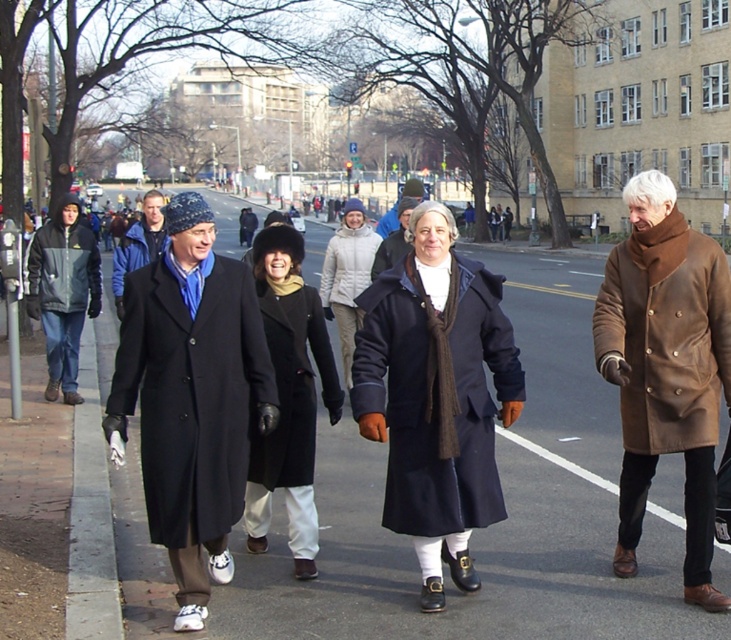
Is brown leather coat at right below white puffy coat at center?

Correct, brown leather coat at right is located below white puffy coat at center.

Does brown leather coat at right have a lesser height compared to white puffy coat at center?

No.

This screenshot has height=640, width=731. I want to click on brown leather coat at right, so click(x=666, y=336).

Find the location of `brown leather coat at right`. brown leather coat at right is located at coordinates (666, 336).

Does black wool coat at left have a lesser height compared to black woolen coat at center?

No.

Who is more forward, (221, 310) or (306, 394)?

Point (221, 310)

Does point (211, 412) come farther from viewer compared to point (295, 333)?

No, it is in front of (295, 333).

At what (x,y) coordinates should I click in order to perform the action: click on black wool coat at left. Please return your answer as a coordinate pair (x, y). The height and width of the screenshot is (640, 731). Looking at the image, I should click on (192, 396).

Is point (379, 346) positioned after point (56, 220)?

That is False.

Who is shorter, navy wool coat at center or matte black coat at left?

Standing shorter between the two is matte black coat at left.

Does point (442, 444) come farther from viewer compared to point (80, 284)?

No.

The height and width of the screenshot is (640, 731). In order to click on navy wool coat at center in this screenshot , I will do `click(436, 396)`.